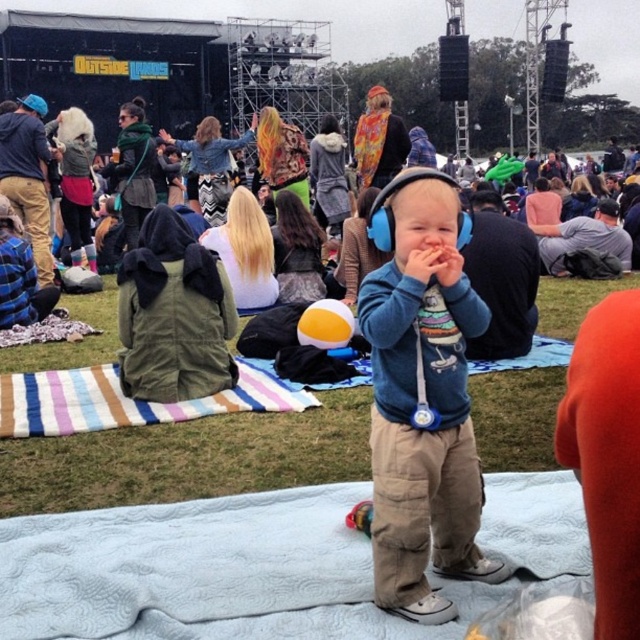
Which is above, blue quilted blanket at center or blue fabric headphones at center?

blue fabric headphones at center is above.

Based on the photo, is blue quilted blanket at center below blue fabric headphones at center?

Yes.

Between point (35, 580) and point (390, 550), which one is positioned behind?

Positioned behind is point (35, 580).

Where is `blue quilted blanket at center`? This screenshot has width=640, height=640. blue quilted blanket at center is located at coordinates (208, 572).